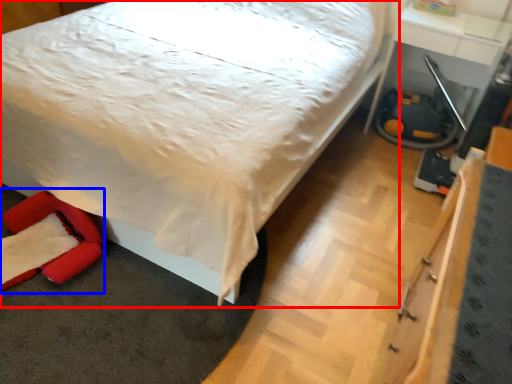
Question: Among these objects, which one is farthest to the camera, bed (highlighted by a red box) or swivel chair (highlighted by a blue box)?

Choices:
 (A) bed
 (B) swivel chair

Answer: (B)